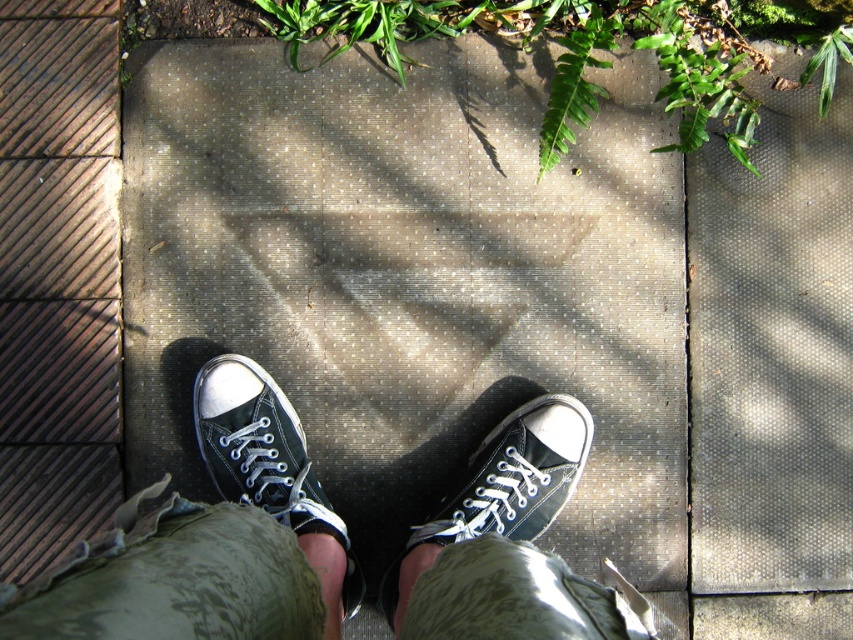
Question: Is matte black sneaker at center to the right of black canvas shoe at center from the viewer's perspective?

Choices:
 (A) no
 (B) yes

Answer: (A)

Question: Which point is closer to the camera?

Choices:
 (A) (384, 612)
 (B) (276, 509)
 (C) (258, 502)

Answer: (B)

Question: Does black canvas shoes at center have a lesser width compared to black canvas shoe at center?

Choices:
 (A) yes
 (B) no

Answer: (B)

Question: Can you confirm if black canvas shoes at center is bigger than black canvas shoe at center?

Choices:
 (A) no
 (B) yes

Answer: (B)

Question: Which object is closer to the camera taking this photo?

Choices:
 (A) black canvas shoes at center
 (B) black canvas shoe at center
 (C) matte black sneaker at center

Answer: (A)

Question: Which is nearer to the black canvas shoes at center?

Choices:
 (A) black canvas shoe at center
 (B) matte black sneaker at center

Answer: (B)